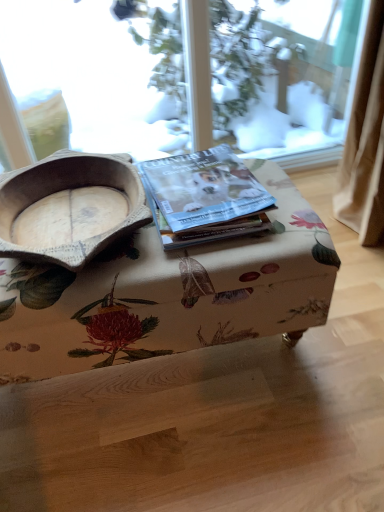
You are a GUI agent. You are given a task and a screenshot of the screen. Output one action in this format:
    pyautogui.click(x=<x>, y=<y>)
    Task: Click on the vacant region above matte paper magazine at center (from a real-world perspective)
    The image size is (384, 512).
    Given the screenshot: What is the action you would take?
    pyautogui.click(x=197, y=183)